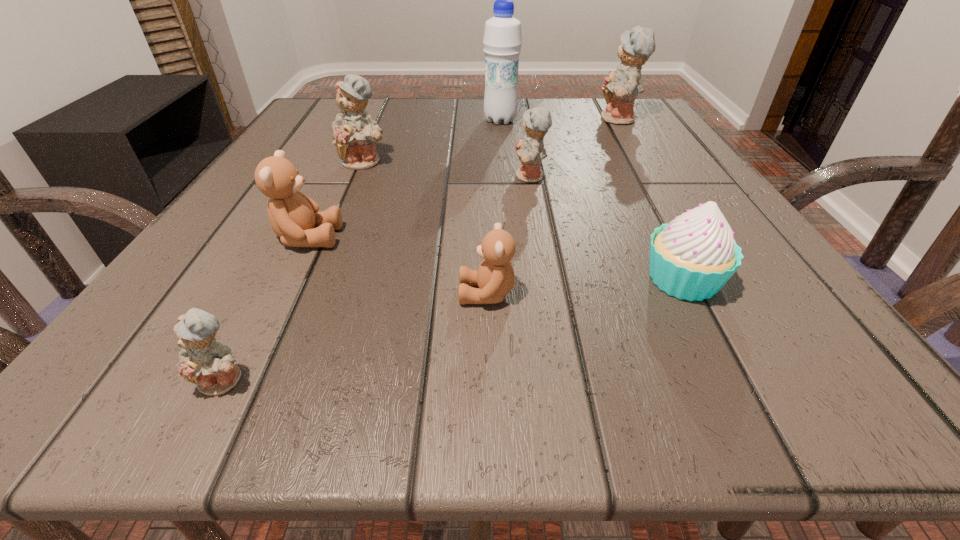
Identify the location of object that is the third closest to the nearest teddy bear. The width and height of the screenshot is (960, 540). (355, 133).

Select which object is the sixth closest to the third smallest blue teddy bear. Please provide its 2D coordinates. Your answer should be formatted as a tuple, i.e. [(x, y)], where the tuple contains the x and y coordinates of a point satisfying the conditions above.

[(620, 88)]

Locate which teddy bear is the second closest to the third tallest object. Please provide its 2D coordinates. Your answer should be formatted as a tuple, i.e. [(x, y)], where the tuple contains the x and y coordinates of a point satisfying the conditions above.

[(530, 150)]

Select which teddy bear is the fifth closest to the second nearest teddy bear. Please provide its 2D coordinates. Your answer should be formatted as a tuple, i.e. [(x, y)], where the tuple contains the x and y coordinates of a point satisfying the conditions above.

[(620, 88)]

Identify which blue teddy bear is located as the second nearest to the water bottle. Please provide its 2D coordinates. Your answer should be formatted as a tuple, i.e. [(x, y)], where the tuple contains the x and y coordinates of a point satisfying the conditions above.

[(530, 150)]

Locate an element on the screen. The image size is (960, 540). blue teddy bear that is the third closest one to the cupcake is located at coordinates (355, 133).

Where is `vacant area in the image that satisfies the following two spatial constraints: 1. on the face of the fourth teddy bear from left to right; 2. on the front-facing side of the nearest teddy bear`? vacant area in the image that satisfies the following two spatial constraints: 1. on the face of the fourth teddy bear from left to right; 2. on the front-facing side of the nearest teddy bear is located at coordinates (489, 381).

Find the location of a particular element. Image resolution: width=960 pixels, height=540 pixels. free space that satisfies the following two spatial constraints: 1. on the face of the third nearest teddy bear; 2. on the front-facing side of the smallest blue teddy bear is located at coordinates (236, 381).

I want to click on free location that satisfies the following two spatial constraints: 1. on the front-facing side of the farthest teddy bear; 2. on the front-facing side of the nearest object, so click(778, 381).

Image resolution: width=960 pixels, height=540 pixels. What are the coordinates of `vacant region that satisfies the following two spatial constraints: 1. on the front-facing side of the farthest teddy bear; 2. on the front-facing side of the nearest blue teddy bear` in the screenshot? It's located at (778, 381).